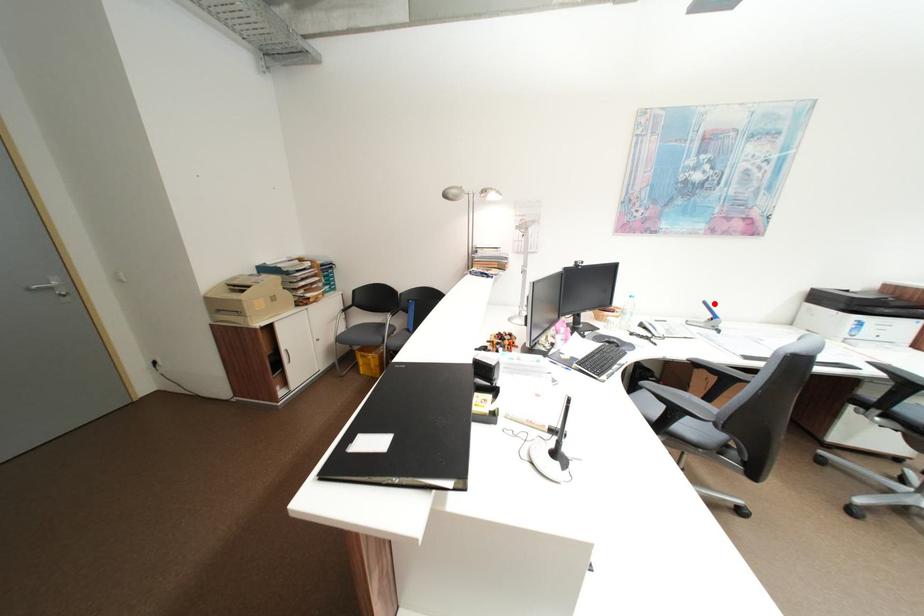
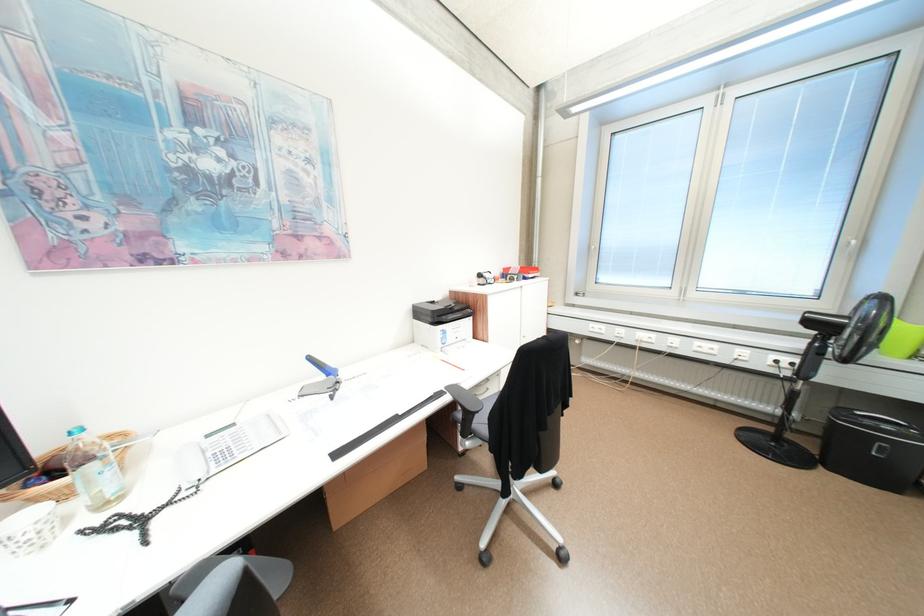
Question: A red point is marked in image1. In image2, is the corresponding 3D point closer to the camera or farther? Reply with the corresponding letter.

Choices:
 (A) The corresponding 3D point is closer.
 (B) The corresponding 3D point is farther.

Answer: (A)